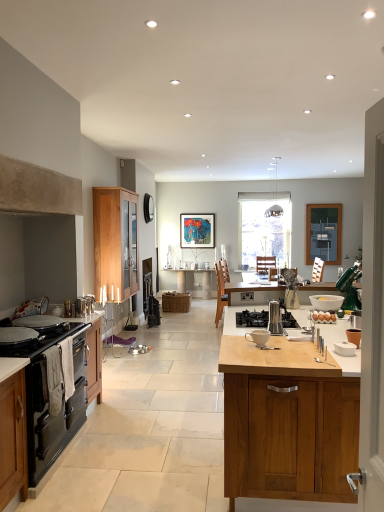
Question: From the image's perspective, is black matte oven at left, placed as the 3th cabinetry when sorted from right to left, over woven brown picnic basket at center?

Choices:
 (A) no
 (B) yes

Answer: (A)

Question: Is black matte oven at left, acting as the second cabinetry starting from the back, positioned with its back to woven brown picnic basket at center?

Choices:
 (A) yes
 (B) no

Answer: (B)

Question: Would you say black matte oven at left, the first cabinetry positioned from the left, contains woven brown picnic basket at center?

Choices:
 (A) no
 (B) yes

Answer: (A)

Question: Is black matte oven at left, acting as the second cabinetry starting from the back, aimed at woven brown picnic basket at center?

Choices:
 (A) yes
 (B) no

Answer: (B)

Question: Is black matte oven at left, acting as the second cabinetry starting from the back, taller than woven brown picnic basket at center?

Choices:
 (A) yes
 (B) no

Answer: (A)

Question: From the image's perspective, relative to brown matte eggs at center, is woven brown picnic basket at center above or below?

Choices:
 (A) below
 (B) above

Answer: (A)

Question: Relative to brown matte eggs at center, is woven brown picnic basket at center in front or behind?

Choices:
 (A) front
 (B) behind

Answer: (B)

Question: In terms of width, does woven brown picnic basket at center look wider or thinner when compared to brown matte eggs at center?

Choices:
 (A) thin
 (B) wide

Answer: (B)

Question: Looking at the image, does woven brown picnic basket at center seem bigger or smaller compared to brown matte eggs at center?

Choices:
 (A) big
 (B) small

Answer: (A)

Question: Which is correct: metallic silver kettle at left, which appears as the fifth appliance when viewed from the right, is inside black matte stove at left, or outside of it?

Choices:
 (A) inside
 (B) outside

Answer: (B)

Question: In terms of size, does metallic silver kettle at left, which is the second appliance in left-to-right order, appear bigger or smaller than black matte stove at left?

Choices:
 (A) small
 (B) big

Answer: (A)

Question: Does point pyautogui.click(x=77, y=298) appear closer or farther from the camera than point pyautogui.click(x=8, y=345)?

Choices:
 (A) closer
 (B) farther

Answer: (B)

Question: From the image's perspective, relative to black matte stove at left, is metallic silver kettle at left, the 4th appliance when ordered from back to front, above or below?

Choices:
 (A) above
 (B) below

Answer: (A)

Question: Is point (86, 303) positioned closer to the camera than point (82, 311)?

Choices:
 (A) farther
 (B) closer

Answer: (A)

Question: In terms of width, does satin nickel faucet at center, the 4th appliance positioned from the front, look wider or thinner when compared to metallic silver kettle at left, the 4th appliance when ordered from back to front?

Choices:
 (A) thin
 (B) wide

Answer: (A)